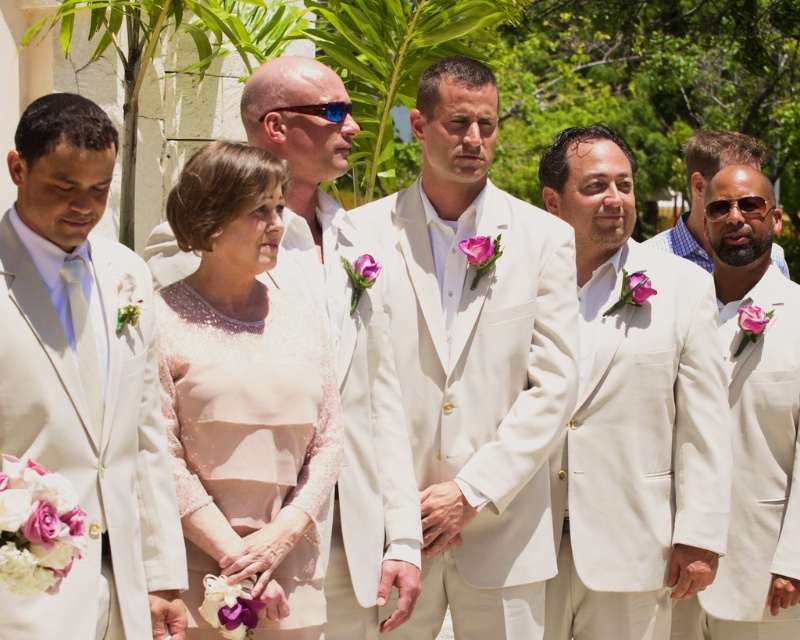
Question: From the image, what is the correct spatial relationship of white satin suit at center in relation to pearl lace dress at center?

Choices:
 (A) left
 (B) right

Answer: (B)

Question: Is matte white suit at center closer to the viewer compared to white linen suit at right?

Choices:
 (A) yes
 (B) no

Answer: (A)

Question: Which of the following is the farthest from the observer?

Choices:
 (A) matte white suit at right
 (B) matte white suit at left
 (C) pearl lace dress at center
 (D) matte white suit at center

Answer: (A)

Question: Is matte white suit at left smaller than white satin suit at center?

Choices:
 (A) no
 (B) yes

Answer: (B)

Question: Which object is the farthest from the white satin suit at center?

Choices:
 (A) pearl lace dress at center
 (B) matte white suit at center

Answer: (A)

Question: Which object is positioned farthest from the matte white suit at left?

Choices:
 (A) matte white suit at right
 (B) pearl lace dress at center
 (C) white satin suit at center
 (D) white linen suit at right

Answer: (A)